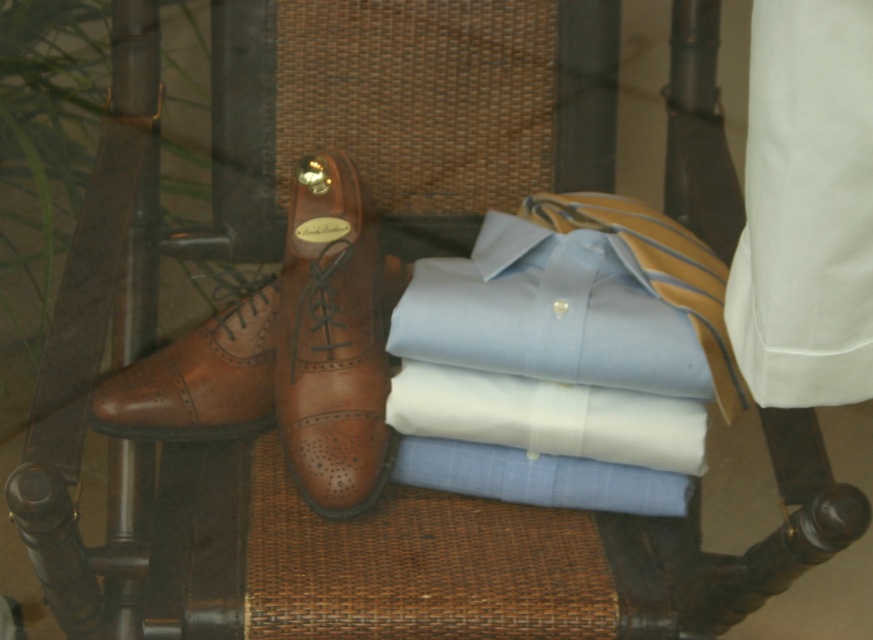
Is the position of light blue cotton shirt at center less distant than that of brown leather shoe at center?

Yes, light blue cotton shirt at center is in front of brown leather shoe at center.

Does light blue cotton shirt at center have a greater height compared to brown leather shoe at center?

In fact, light blue cotton shirt at center may be shorter than brown leather shoe at center.

Locate an element on the screen. Image resolution: width=873 pixels, height=640 pixels. light blue cotton shirt at center is located at coordinates (548, 314).

Is brown leather shoe at center further to the viewer compared to white cotton shirt at center?

That is True.

Can you confirm if brown leather shoe at center is thinner than white cotton shirt at center?

Yes, brown leather shoe at center is thinner than white cotton shirt at center.

Between point (324, 332) and point (459, 435), which one is positioned in front?

Point (459, 435) is in front.

I want to click on brown leather shoe at center, so click(333, 339).

How distant is light blue cotton shirt at center from white cotton shirt at center?

A distance of 6.44 centimeters exists between light blue cotton shirt at center and white cotton shirt at center.

Who is more forward, (480, 356) or (511, 408)?

Point (480, 356) is more forward.

Image resolution: width=873 pixels, height=640 pixels. In order to click on light blue cotton shirt at center in this screenshot , I will do 548,314.